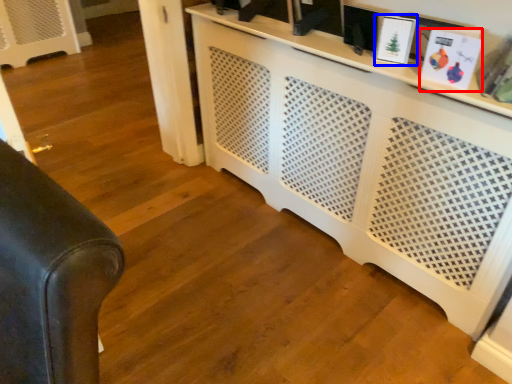
Question: Which point is further to the camera, picture frame (highlighted by a red box) or picture frame (highlighted by a blue box)?

Choices:
 (A) picture frame
 (B) picture frame

Answer: (B)